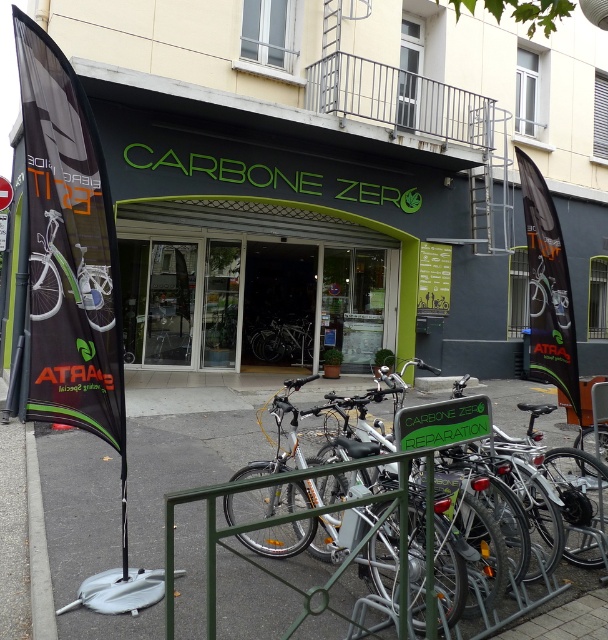
You are standing in front of the CARBONE ZERO bicycle shop. You need to place a 2.5 meter long banner on the ground between the entrance and the bike rack. The banner must be placed on the gray concrete pavement at lower left. Is there enough space for the banner?

The gray concrete pavement at lower left is 3.10 meters away from the camera. Since the banner is 2.5 meters long, there is sufficient space to place it on the gray concrete pavement at lower left.

You are standing in front of the CARBONE ZERO bicycle shop. The green matte storefront at center is part of the building. If you want to take a photo of the entire storefront without moving your camera position, what is the minimum distance you need to be from the storefront?

The minimum distance you need to be from the green matte storefront at center is 9.05 meters to capture the entire storefront in the photo without moving the camera position.

You are standing in front of CARBONE ZERO bicycle shop. You see two points marked on the ground, one at coordinates point (x=161, y=516) and another at point (x=308, y=326). Which point is closer to the entrance archway?

Point (x=161, y=516) is in front of point (x=308, y=326), so it is closer to the entrance archway.